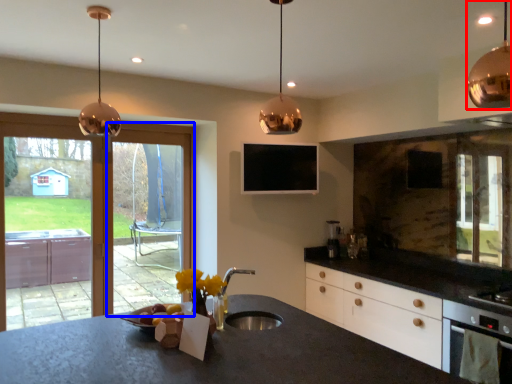
Question: Which of the following is the closest to the observer, lamp (highlighted by a red box) or screen door (highlighted by a blue box)?

Choices:
 (A) lamp
 (B) screen door

Answer: (A)